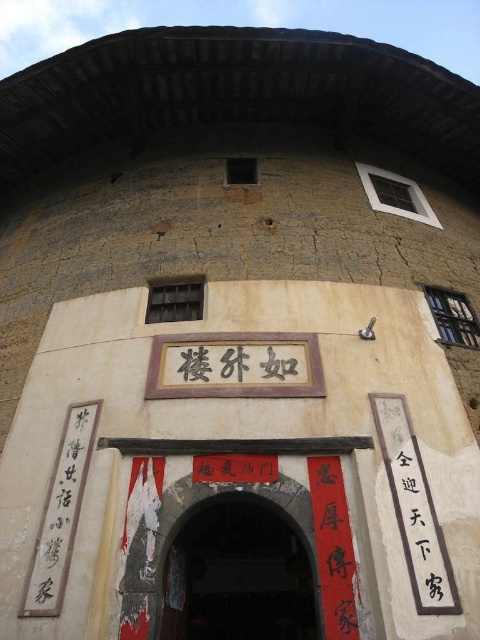
Question: Which of the following is the closest to the observer?

Choices:
 (A) (404, 516)
 (B) (240, 353)
 (C) (162, 586)

Answer: (C)

Question: Which point appears closest to the camera in this image?

Choices:
 (A) (403, 467)
 (B) (244, 364)
 (C) (240, 611)

Answer: (A)

Question: Can you confirm if black wood sign at center is smaller than black calligraphy at right?

Choices:
 (A) no
 (B) yes

Answer: (A)

Question: Does dark brown wooden door at center appear on the left side of black calligraphy at right?

Choices:
 (A) no
 (B) yes

Answer: (B)

Question: Does dark brown wooden door at center have a lesser width compared to black calligraphy at right?

Choices:
 (A) yes
 (B) no

Answer: (B)

Question: Which object appears closest to the camera in this image?

Choices:
 (A) dark brown wooden door at center
 (B) black wood sign at center

Answer: (A)